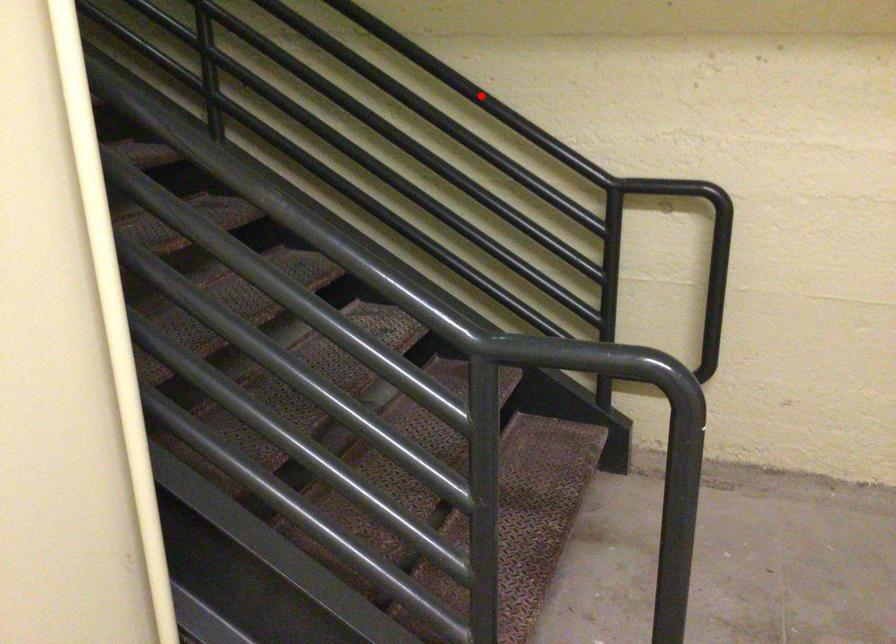
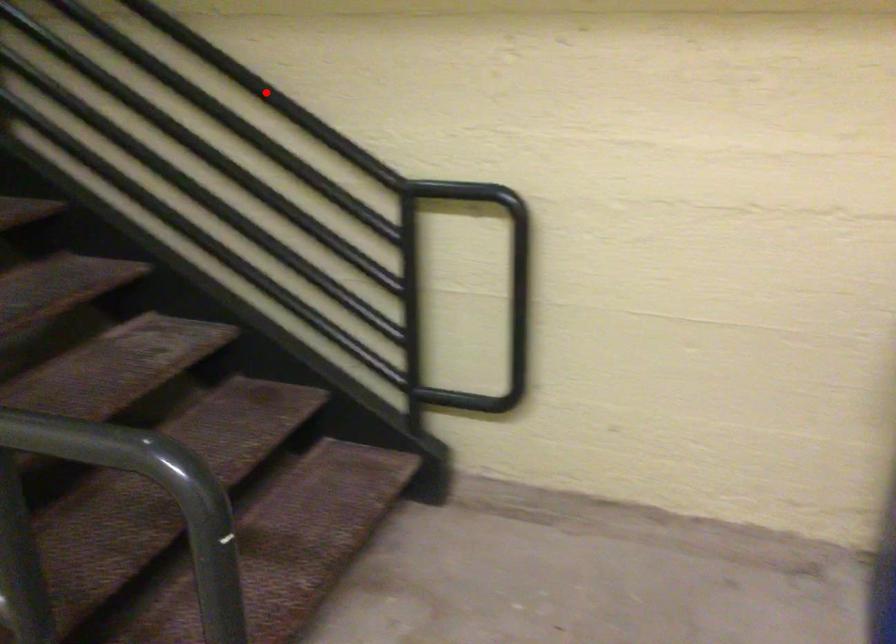
I am providing you with two images of the same scene from different viewpoints. A red point is marked on the first image and another point is marked on the second image. Are the points marked in image1 and image2 representing the same 3D position?

Yes